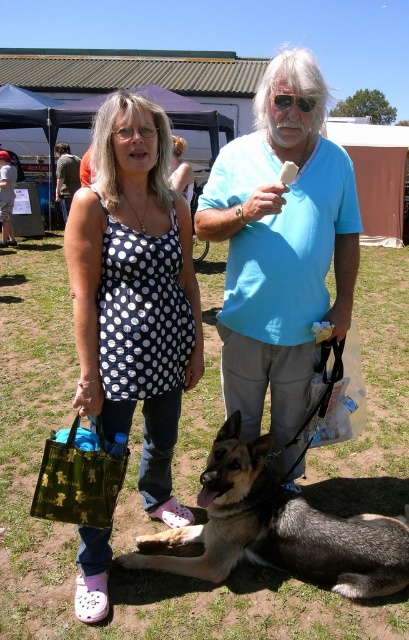
Question: Can you confirm if blue cotton shirt at center is positioned above matte black tank top at upper left?

Choices:
 (A) no
 (B) yes

Answer: (A)

Question: Can you confirm if blue cotton shirt at center is thinner than brown fur dog at center?

Choices:
 (A) no
 (B) yes

Answer: (B)

Question: Among these objects, which one is nearest to the camera?

Choices:
 (A) black polka dot dress at center
 (B) matte black tank top at upper left
 (C) blue cotton shirt at center

Answer: (A)

Question: Does polka dot fabric dress at center appear on the right side of black polka dot dress at center?

Choices:
 (A) no
 (B) yes

Answer: (B)

Question: Among these objects, which one is farthest from the camera?

Choices:
 (A) brown fur dog at center
 (B) blue cotton shirt at center

Answer: (A)

Question: Among these objects, which one is farthest from the camera?

Choices:
 (A) brown fur dog at center
 (B) blue cotton shirt at center
 (C) matte black tank top at upper left

Answer: (C)